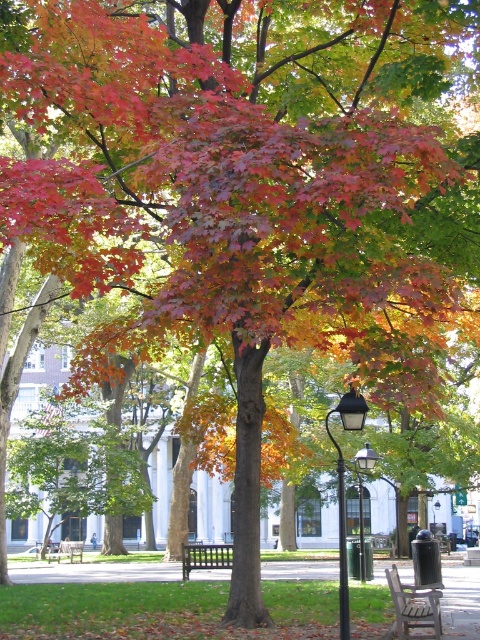
You are sitting on the wooden bench at center in the park. You want to turn around and look towards the black metal streetlight at lower right. Which direction should you turn?

The black metal streetlight at lower right is in front of the wooden bench at center, so you are already facing the direction of the streetlight. Therefore, you don not need to turn. Just look forward.

You are standing at the point where the black wooden bench at center is located. Which direction should you walk to reach the large white building with classical architectural features in the background?

Since the large white building with classical architectural features is in the background and the black wooden bench at center is at point (205, 556), you should walk towards the direction of the background, which is likely north, to reach the building.